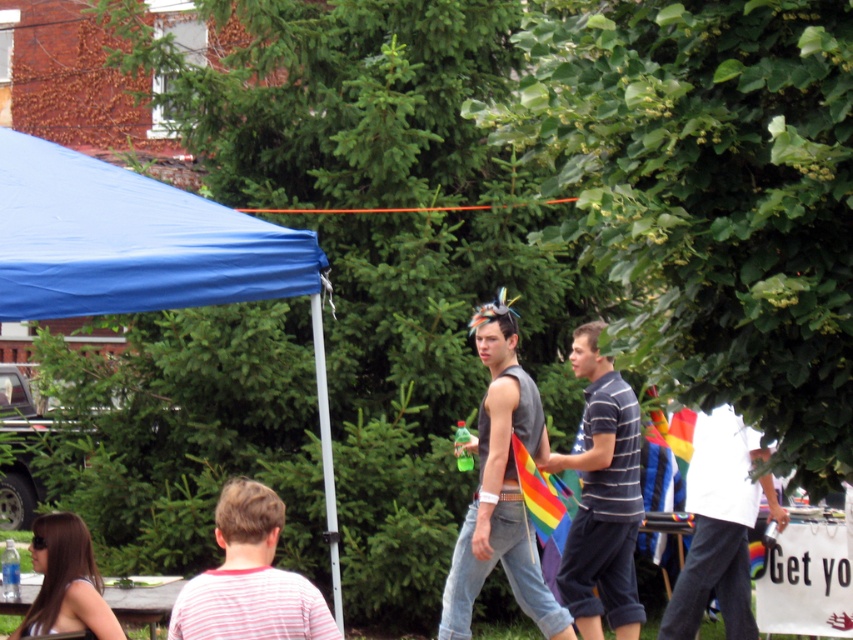
Question: Does gray sleeveless shirt at center appear under white cotton shirt at right?

Choices:
 (A) yes
 (B) no

Answer: (B)

Question: Does blue fabric tent at upper left come behind wooden picnic table at lower left?

Choices:
 (A) no
 (B) yes

Answer: (A)

Question: Which is farther from the pink striped shirt at lower left?

Choices:
 (A) white cotton shirt at right
 (B) gray sleeveless shirt at center
 (C) wooden picnic table at lower left

Answer: (A)

Question: Which object is closer to the camera taking this photo?

Choices:
 (A) pink striped shirt at lower left
 (B) striped cotton shirt at center

Answer: (A)

Question: Is gray sleeveless shirt at center further to the viewer compared to pink striped shirt at lower left?

Choices:
 (A) yes
 (B) no

Answer: (A)

Question: Which point is farther to the camera?

Choices:
 (A) (158, 598)
 (B) (231, 634)

Answer: (A)